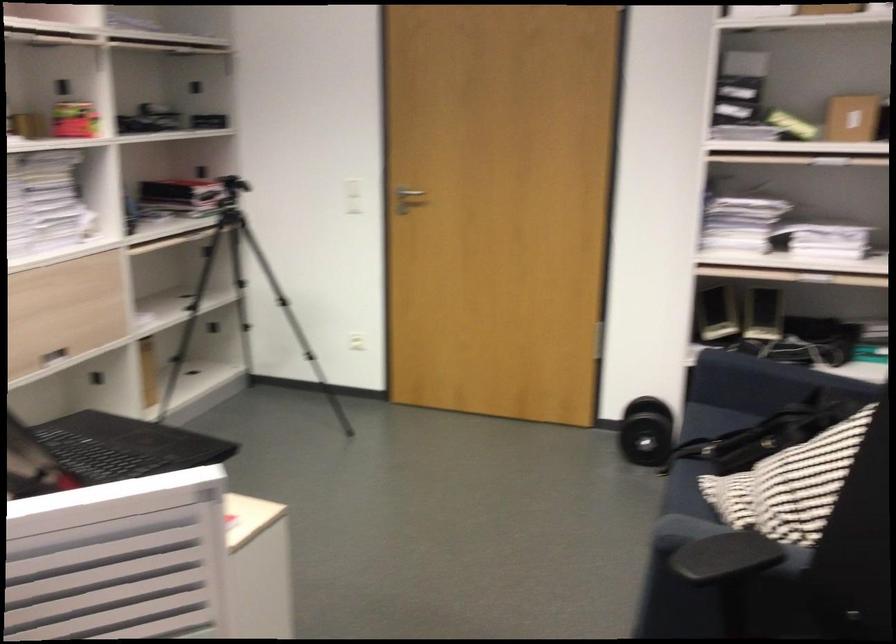
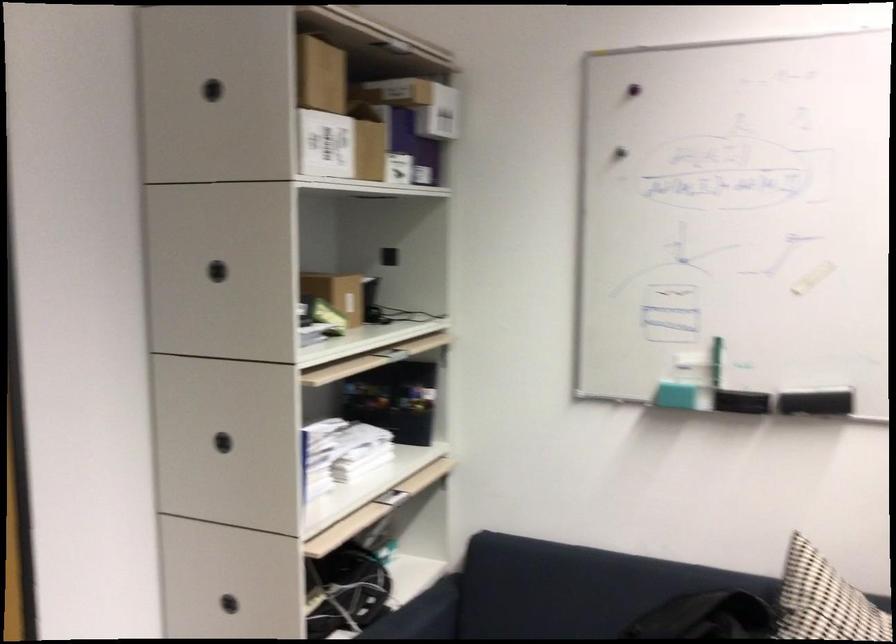
In the second image, find the point that corresponds to (x=716, y=196) in the first image.

(222, 442)